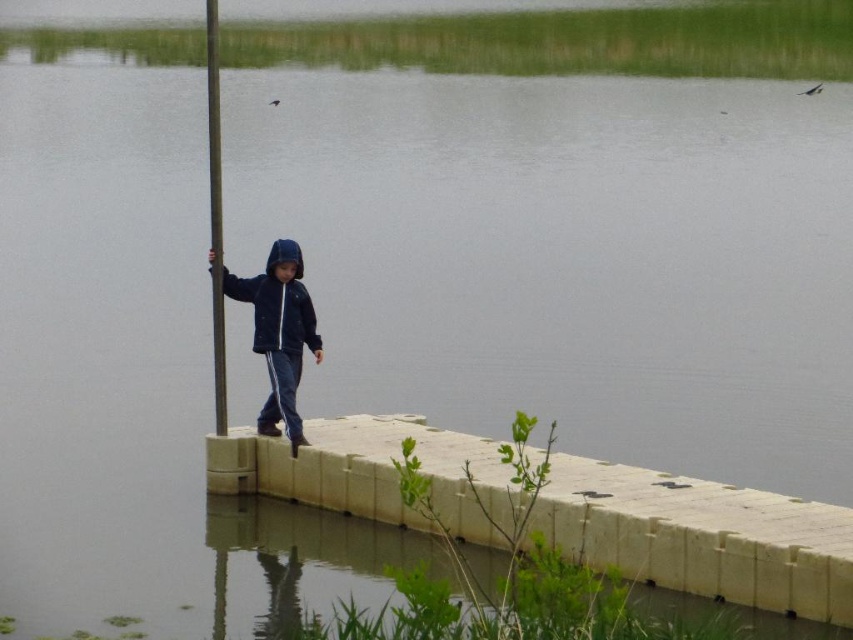
Question: Considering the real-world distances, which object is farthest from the white concrete ledge at center?

Choices:
 (A) metallic pole at left
 (B) dark blue jacket at center

Answer: (A)

Question: Is white concrete ledge at center thinner than metallic pole at left?

Choices:
 (A) no
 (B) yes

Answer: (A)

Question: Can you confirm if white concrete ledge at center is smaller than dark blue jacket at center?

Choices:
 (A) no
 (B) yes

Answer: (A)

Question: Estimate the real-world distances between objects in this image. Which object is closer to the white concrete ledge at center?

Choices:
 (A) metallic pole at left
 (B) dark blue jacket at center

Answer: (B)

Question: Which point is farther from the camera taking this photo?

Choices:
 (A) (224, 420)
 (B) (265, 260)

Answer: (A)

Question: Does dark blue jacket at center have a lesser width compared to metallic pole at left?

Choices:
 (A) no
 (B) yes

Answer: (A)